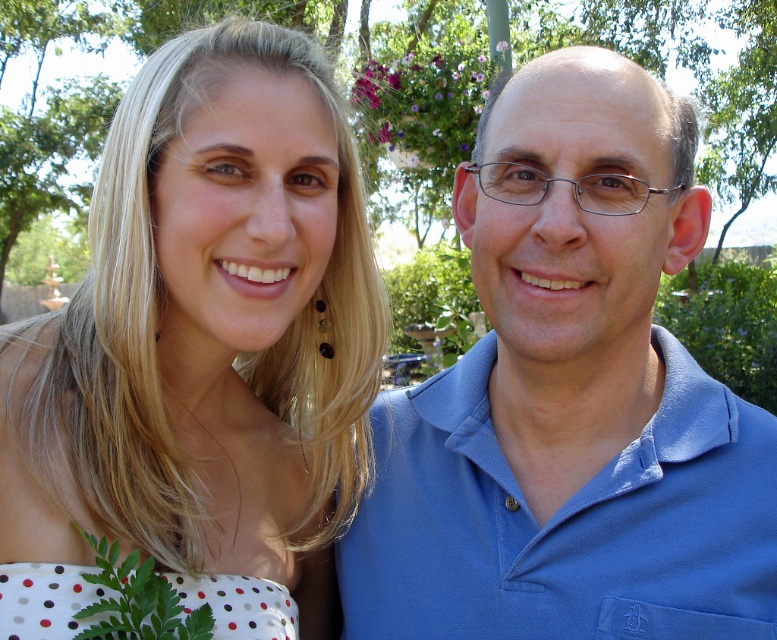
Question: Considering the real-world distances, which object is closest to the white dotted dress at left?

Choices:
 (A) blue cotton shirt at right
 (B) white polka dot fabric at lower left

Answer: (B)

Question: Does white dotted dress at left have a larger size compared to white polka dot fabric at lower left?

Choices:
 (A) no
 (B) yes

Answer: (B)

Question: Which point is farther to the camera?

Choices:
 (A) blue cotton shirt at right
 (B) white polka dot fabric at lower left

Answer: (A)

Question: Does blue cotton shirt at right lie in front of white polka dot fabric at lower left?

Choices:
 (A) yes
 (B) no

Answer: (B)

Question: Is blue cotton shirt at right positioned before white polka dot fabric at lower left?

Choices:
 (A) yes
 (B) no

Answer: (B)

Question: Among these points, which one is farthest from the camera?

Choices:
 (A) (706, 420)
 (B) (136, 372)
 (C) (37, 636)

Answer: (A)